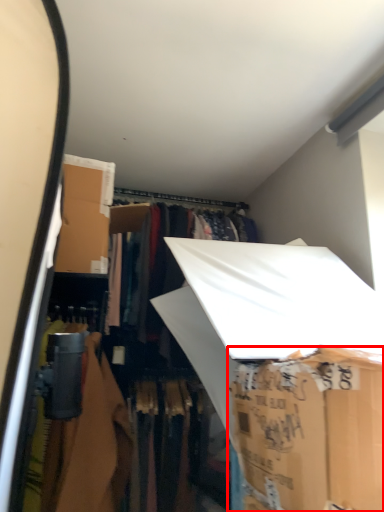
Question: Where is storage box (annotated by the red box) located in relation to storage box in the image?

Choices:
 (A) right
 (B) left

Answer: (A)